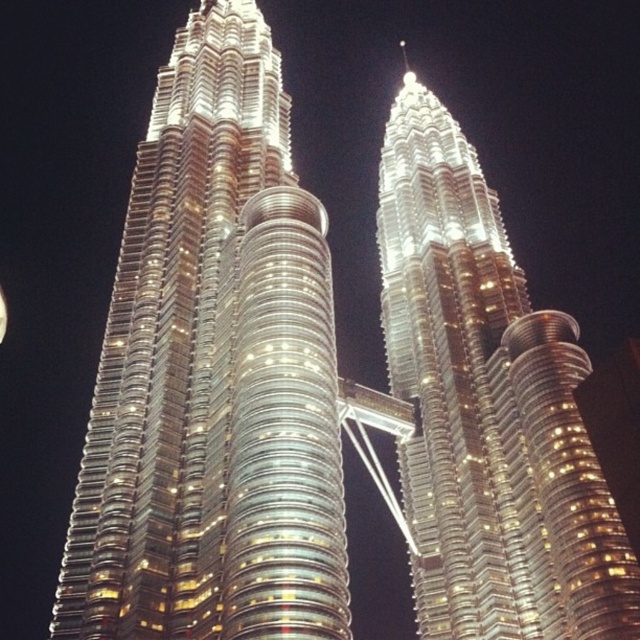
Question: Is shiny metallic twin towers at center bigger than bright silver moon at upper left?

Choices:
 (A) yes
 (B) no

Answer: (A)

Question: Does shiny metallic skyscraper at center appear over bright silver moon at upper left?

Choices:
 (A) no
 (B) yes

Answer: (B)

Question: Is shiny metallic twin towers at center positioned behind bright silver moon at upper left?

Choices:
 (A) no
 (B) yes

Answer: (A)

Question: Among these points, which one is nearest to the camera?

Choices:
 (A) (529, 608)
 (B) (243, 225)

Answer: (A)

Question: Which is nearer to the bright silver moon at upper left?

Choices:
 (A) shiny metallic twin towers at center
 (B) shiny metallic skyscraper at center

Answer: (B)

Question: Among these points, which one is nearest to the camera?

Choices:
 (A) (465, 268)
 (B) (285, 380)

Answer: (B)